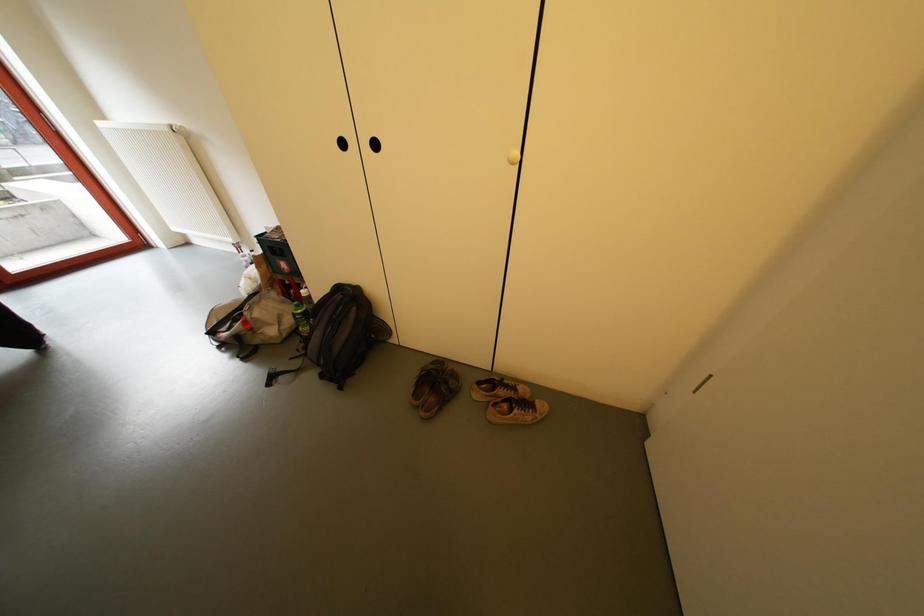
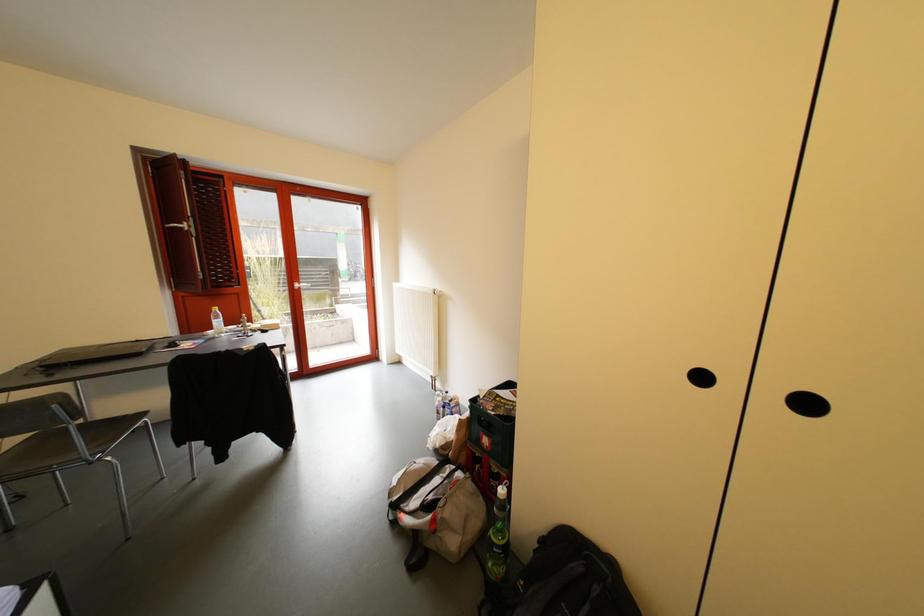
First-person continuous shooting, in which direction is the camera rotating?

The camera's rotation is toward left-up.